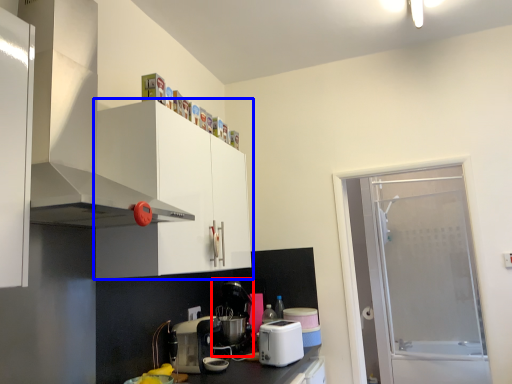
Question: Which object appears farthest to the camera in this image, coffee machine (highlighted by a red box) or cabinetry (highlighted by a blue box)?

Choices:
 (A) coffee machine
 (B) cabinetry

Answer: (A)